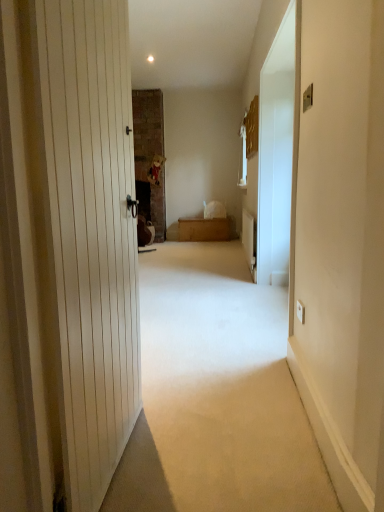
Identify the location of vacant space in white glossy screen door at right (from a real-world perspective). (277, 312).